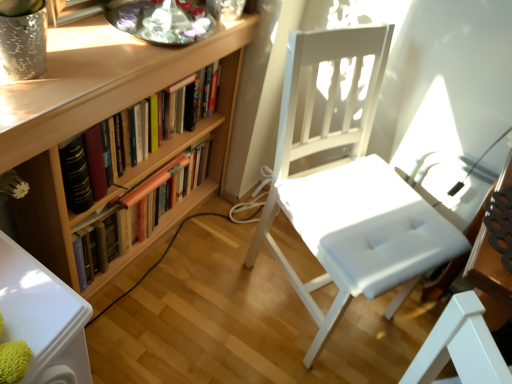
Question: From the image's perspective, is wooden bookshelf at left, the second book ordered from the bottom, above or below wooden bookshelf at left, marked as the second book in a top-to-bottom arrangement?

Choices:
 (A) below
 (B) above

Answer: (B)

Question: Is wooden bookshelf at left, the first book positioned from the top, inside the boundaries of wooden bookshelf at left, marked as the second book in a top-to-bottom arrangement, or outside?

Choices:
 (A) outside
 (B) inside

Answer: (A)

Question: Which object is positioned farthest from the wooden bookshelf at left, the 1th book positioned from the bottom?

Choices:
 (A) wooden bookcase at left
 (B) wooden bookshelf at left, the second book ordered from the bottom
 (C) white leather chair at center

Answer: (C)

Question: Estimate the real-world distances between objects in this image. Which object is farther from the wooden bookshelf at left, the 1th book positioned from the bottom?

Choices:
 (A) wooden bookshelf at left, the first book positioned from the top
 (B) wooden bookcase at left
 (C) white leather chair at center

Answer: (C)